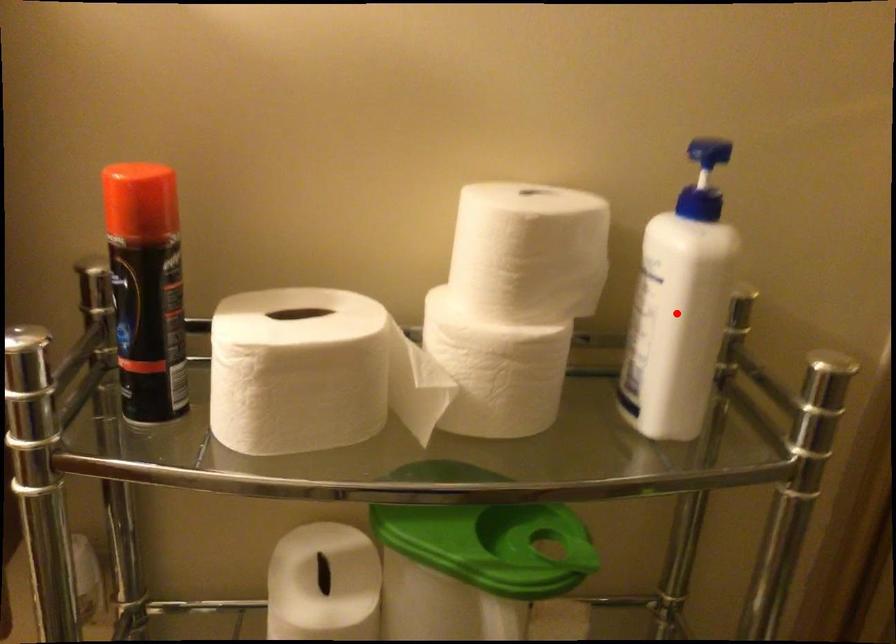
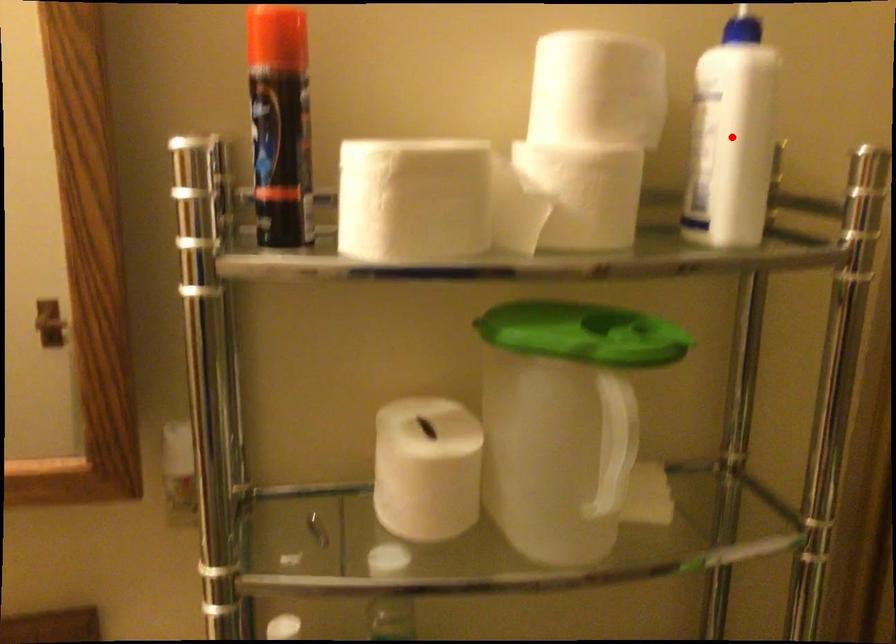
I am providing you with two images of the same scene from different viewpoints. A red point is marked on the first image and another point is marked on the second image. Do the highlighted points in image1 and image2 indicate the same real-world spot?

Yes